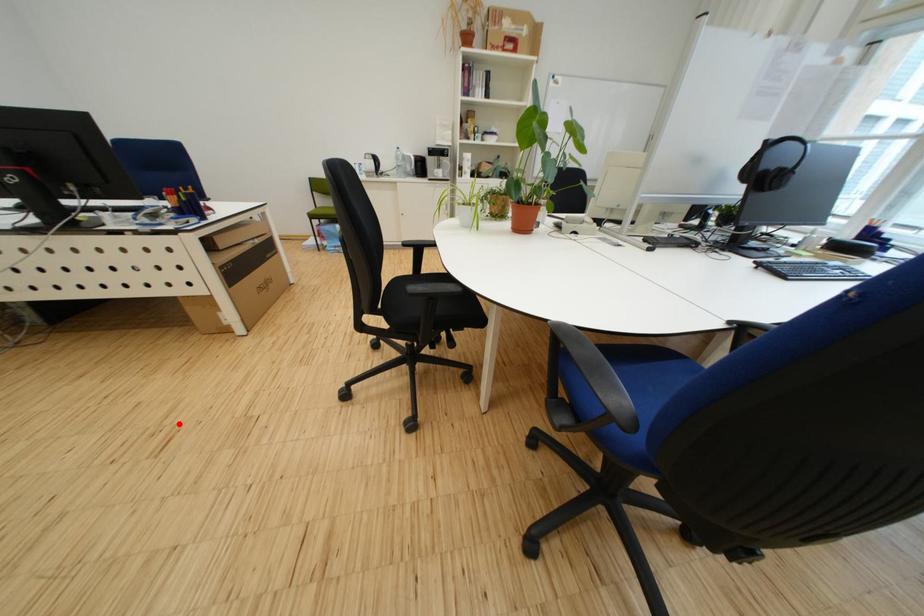
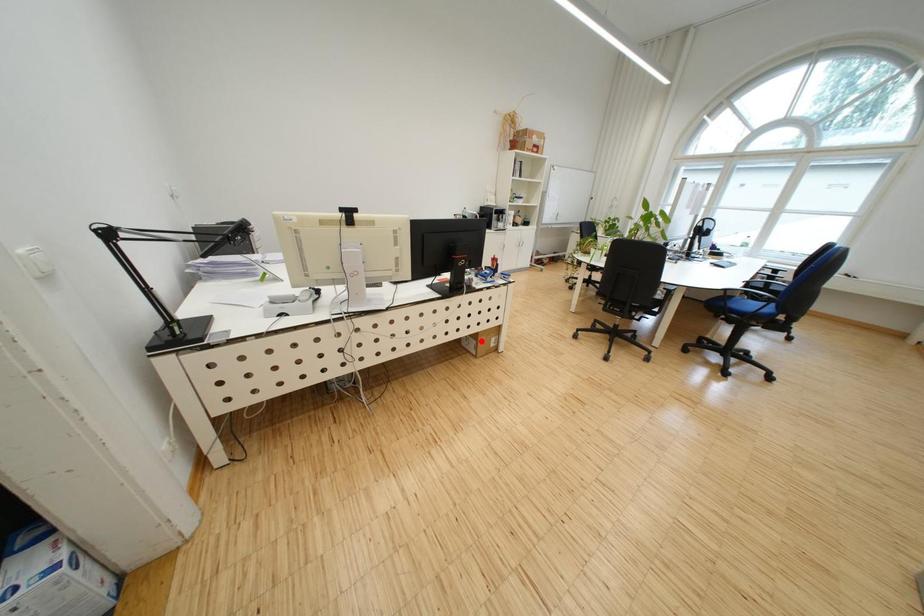
I am providing you with two images of the same scene from different viewpoints. A red point is marked on the first image and another point is marked on the second image. Are the points marked in image1 and image2 representing the same 3D position?

No